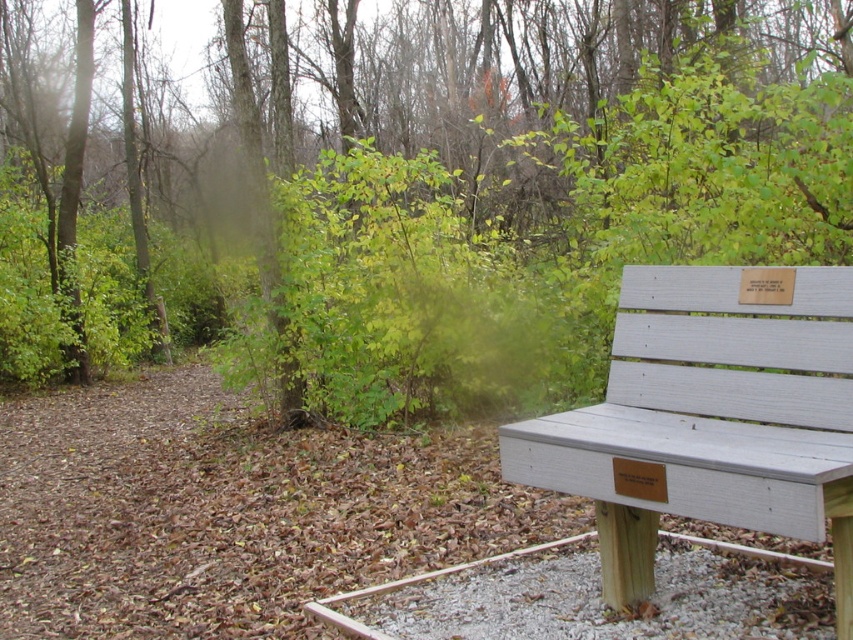
Question: Can you confirm if green leafy tree at upper right is wider than white painted wood bench at right?

Choices:
 (A) yes
 (B) no

Answer: (A)

Question: Which object appears closest to the camera in this image?

Choices:
 (A) white painted wood bench at right
 (B) green leafy tree at upper right

Answer: (A)

Question: Can you confirm if green leafy tree at upper right is bigger than white painted wood bench at right?

Choices:
 (A) no
 (B) yes

Answer: (B)

Question: Which of the following is the farthest from the observer?

Choices:
 (A) (819, 454)
 (B) (352, 328)

Answer: (B)

Question: Is green leafy tree at upper right behind white painted wood bench at right?

Choices:
 (A) yes
 (B) no

Answer: (A)